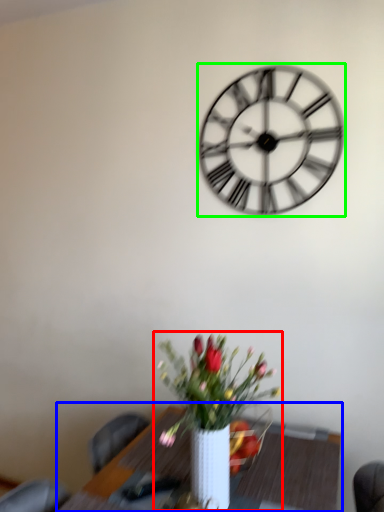
Question: Considering the real-world distances, which object is closest to houseplant (highlighted by a red box)? table (highlighted by a blue box) or wall clock (highlighted by a green box).

Choices:
 (A) table
 (B) wall clock

Answer: (A)